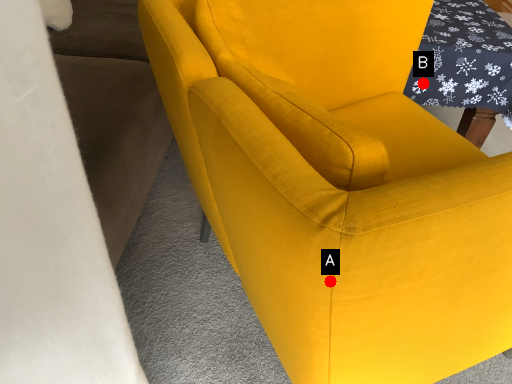
Question: Two points are circled on the image, labeled by A and B beside each circle. Which point is farther from the camera taking this photo?

Choices:
 (A) A is further
 (B) B is further

Answer: (B)